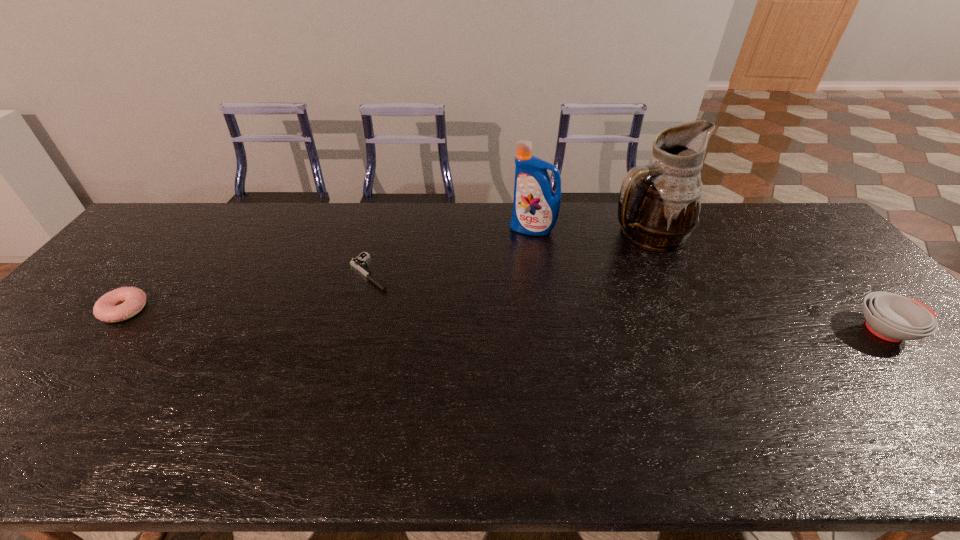
What are the coordinates of `doughnut` in the screenshot? It's located at (120, 304).

At what (x,y) coordinates should I click in order to perform the action: click on the fourth tallest object. Please return your answer as a coordinate pair (x, y). This screenshot has width=960, height=540. Looking at the image, I should click on (120, 304).

I want to click on soup bowl, so click(892, 317).

The width and height of the screenshot is (960, 540). In order to click on the third shortest object in this screenshot , I will do `click(892, 317)`.

At what (x,y) coordinates should I click in order to perform the action: click on the third object from left to right. Please return your answer as a coordinate pair (x, y). The image size is (960, 540). Looking at the image, I should click on (536, 206).

This screenshot has height=540, width=960. Identify the location of detergent. (536, 206).

Where is `pitcher`? Image resolution: width=960 pixels, height=540 pixels. pitcher is located at coordinates (659, 203).

Where is `the second object from right to left`? The width and height of the screenshot is (960, 540). the second object from right to left is located at coordinates (659, 203).

Image resolution: width=960 pixels, height=540 pixels. In order to click on the shortest object in this screenshot , I will do `click(358, 263)`.

I want to click on pistol, so click(x=358, y=263).